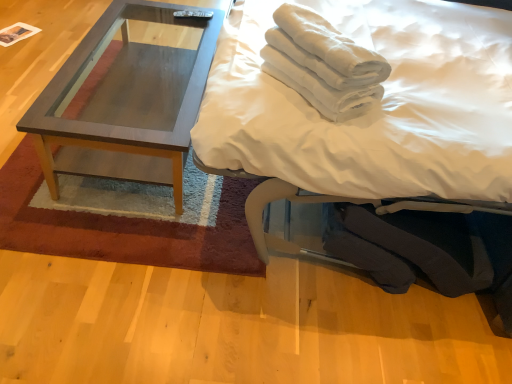
Question: In terms of width, does matte wood coffee table at left look wider or thinner when compared to white cotton towels at upper right?

Choices:
 (A) thin
 (B) wide

Answer: (B)

Question: Based on their sizes in the image, would you say matte wood coffee table at left is bigger or smaller than white cotton towels at upper right?

Choices:
 (A) small
 (B) big

Answer: (B)

Question: Estimate the real-world distances between objects in this image. Which object is farther from the white soft bed at upper right?

Choices:
 (A) wooden coffee table at center
 (B) matte wood coffee table at left
 (C) white cotton towels at upper right

Answer: (A)

Question: Estimate the real-world distances between objects in this image. Which object is closer to the matte wood coffee table at left?

Choices:
 (A) white cotton towels at upper right
 (B) white soft bed at upper right
 (C) wooden coffee table at center

Answer: (C)